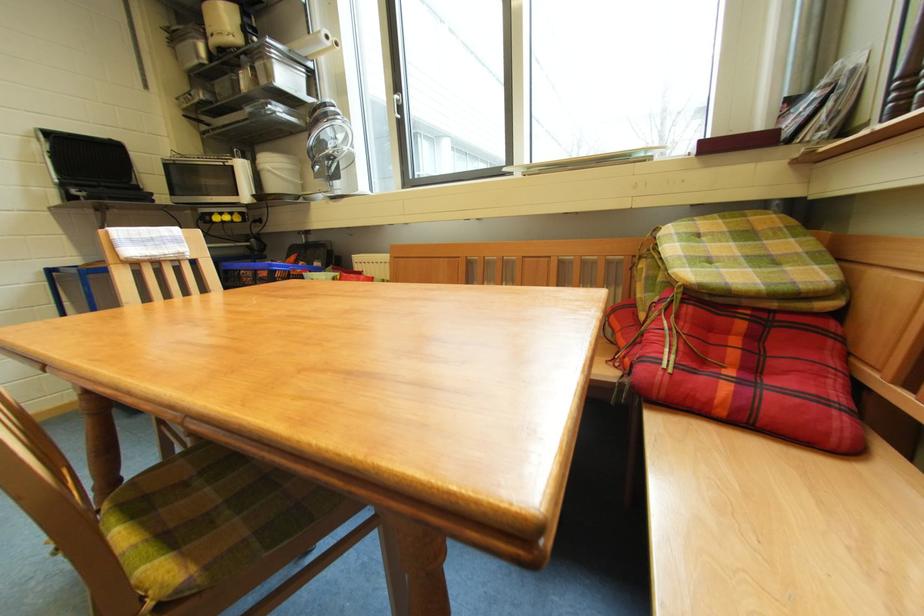
What are the coordinates of `bench sitting surface` in the screenshot? It's located at (777, 524).